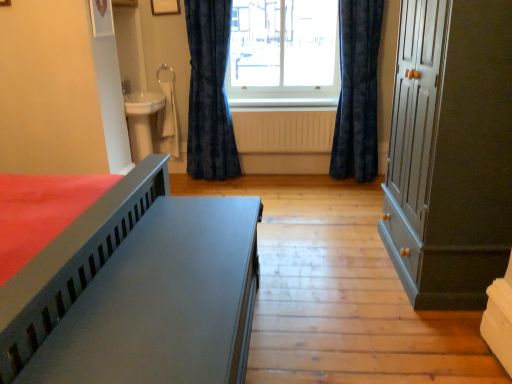
Question: Is velvet dark blue curtain at center, which is counted as the first curtain, starting from the left, taller or shorter than transparent glass window at center?

Choices:
 (A) tall
 (B) short

Answer: (A)

Question: Based on their positions, is velvet dark blue curtain at center, which is counted as the first curtain, starting from the left, located to the left or right of transparent glass window at center?

Choices:
 (A) left
 (B) right

Answer: (A)

Question: Which object is positioned farthest from the velvet dark blue curtain at center, which is counted as the first curtain, starting from the left?

Choices:
 (A) velvet dark blue curtain at center, the 2th curtain when ordered from left to right
 (B) yellow matte radiator at center
 (C) matte gray bed at lower left
 (D) transparent glass window at center
 (E) matte gray cupboard at right

Answer: (C)

Question: Based on their relative distances, which object is nearer to the matte gray bed at lower left?

Choices:
 (A) velvet dark blue curtain at center, which is the 2th curtain in right-to-left order
 (B) transparent glass window at center
 (C) velvet dark blue curtain at center, positioned as the 1th curtain in right-to-left order
 (D) yellow matte radiator at center
 (E) matte gray cupboard at right

Answer: (E)